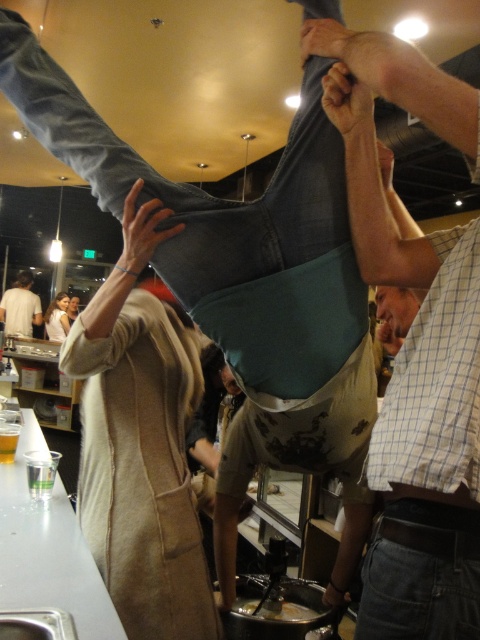
Which is in front, point (181, 422) or point (247, 609)?

Point (181, 422) is more forward.

Is light beige fabric coat at center positioned in front of shiny silver spoon at lower center?

Yes.

Between point (97, 470) and point (283, 616), which one is positioned behind?

Point (283, 616)

You are a GUI agent. You are given a task and a screenshot of the screen. Output one action in this format:
    pyautogui.click(x=<x>, y=<y>)
    Task: Click on the light beige fabric coat at center
    
    Given the screenshot: What is the action you would take?
    pyautogui.click(x=141, y=442)

Between point (451, 467) and point (39, 300), which one is positioned behind?

Positioned behind is point (39, 300).

This screenshot has width=480, height=640. Find the location of `denim jeans at center`. denim jeans at center is located at coordinates (415, 348).

This screenshot has height=640, width=480. What are the coordinates of `denim jeans at center` in the screenshot? It's located at click(415, 348).

This screenshot has height=640, width=480. Find the location of `denim jeans at center`. denim jeans at center is located at coordinates (415, 348).

Can you confirm if light beige fabric coat at center is positioned to the right of white cotton shirt at upper left?

Yes, light beige fabric coat at center is to the right of white cotton shirt at upper left.

Who is more forward, [190,620] or [3,292]?

Positioned in front is point [190,620].

Locate an element on the screen. This screenshot has height=640, width=480. light beige fabric coat at center is located at coordinates (141, 442).